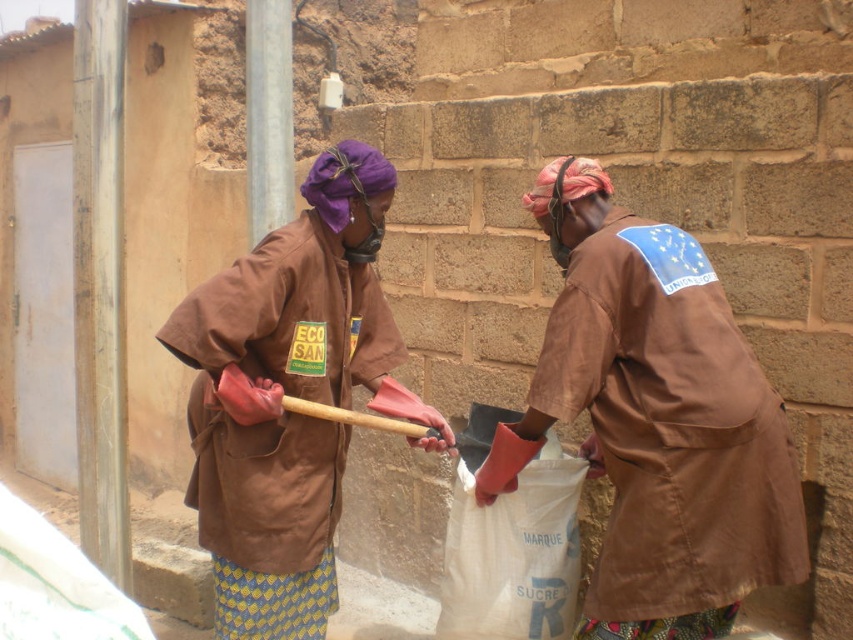
Question: Does brown fabric robe at right appear over brown fabric robe at center?

Choices:
 (A) yes
 (B) no

Answer: (A)

Question: Which object is closer to the camera taking this photo?

Choices:
 (A) brown fabric robe at right
 (B) brown fabric uniform at center
 (C) brown fabric robe at center

Answer: (A)

Question: Does brown fabric uniform at center appear over brown fabric robe at right?

Choices:
 (A) yes
 (B) no

Answer: (B)

Question: Among these points, which one is farthest from the camera?

Choices:
 (A) (325, 332)
 (B) (252, 566)

Answer: (A)

Question: Which of the following is the closest to the observer?

Choices:
 (A) brown fabric robe at center
 (B) brown fabric robe at right

Answer: (B)

Question: Does brown fabric robe at right appear under brown fabric robe at center?

Choices:
 (A) no
 (B) yes

Answer: (A)